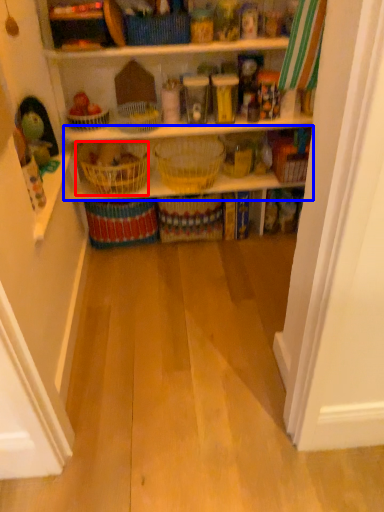
Question: Which point is further to the camera, basket (highlighted by a red box) or shelf (highlighted by a blue box)?

Choices:
 (A) basket
 (B) shelf

Answer: (B)